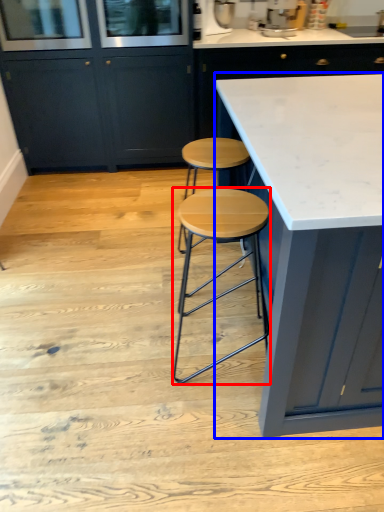
Question: Which point is closer to the camera, stool (highlighted by a red box) or countertop (highlighted by a blue box)?

Choices:
 (A) stool
 (B) countertop

Answer: (B)